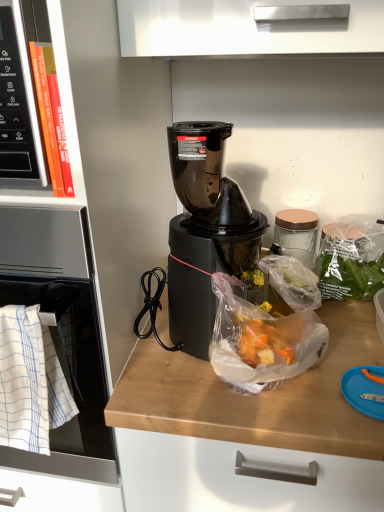
Question: Is orange hardcover book at left to the left or to the right of black plastic blender at center in the image?

Choices:
 (A) right
 (B) left

Answer: (B)

Question: Would you say orange hardcover book at left is inside or outside black plastic blender at center?

Choices:
 (A) outside
 (B) inside

Answer: (A)

Question: Estimate the real-world distances between objects in this image. Which object is farther from the orange hardcover book at left?

Choices:
 (A) black plastic blender at center
 (B) translucent plastic bag at center
 (C) satin silver oven at left
 (D) white woven towel at left

Answer: (B)

Question: Which object is the closest to the orange hardcover book at left?

Choices:
 (A) translucent plastic bag at center
 (B) black plastic blender at center
 (C) satin silver oven at left
 (D) white woven towel at left

Answer: (C)